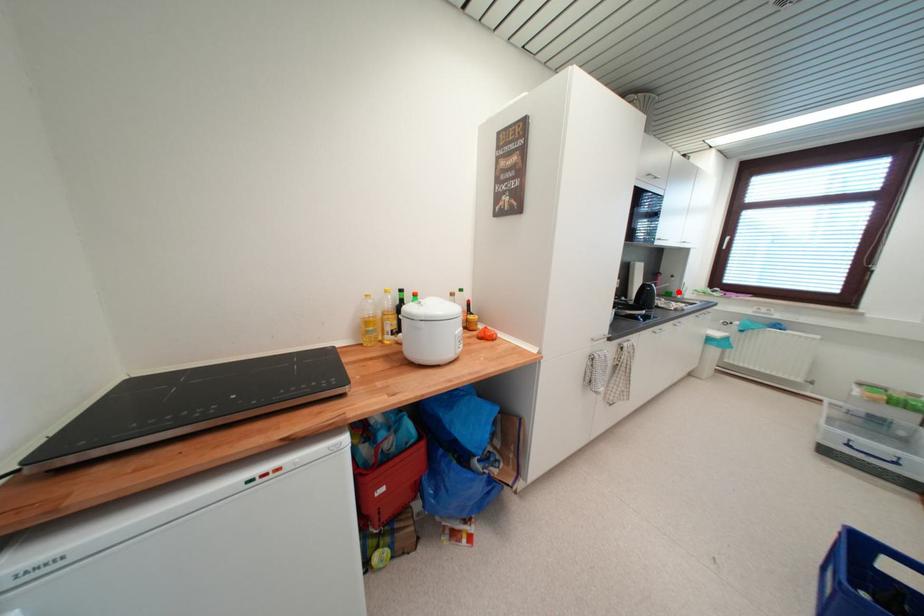
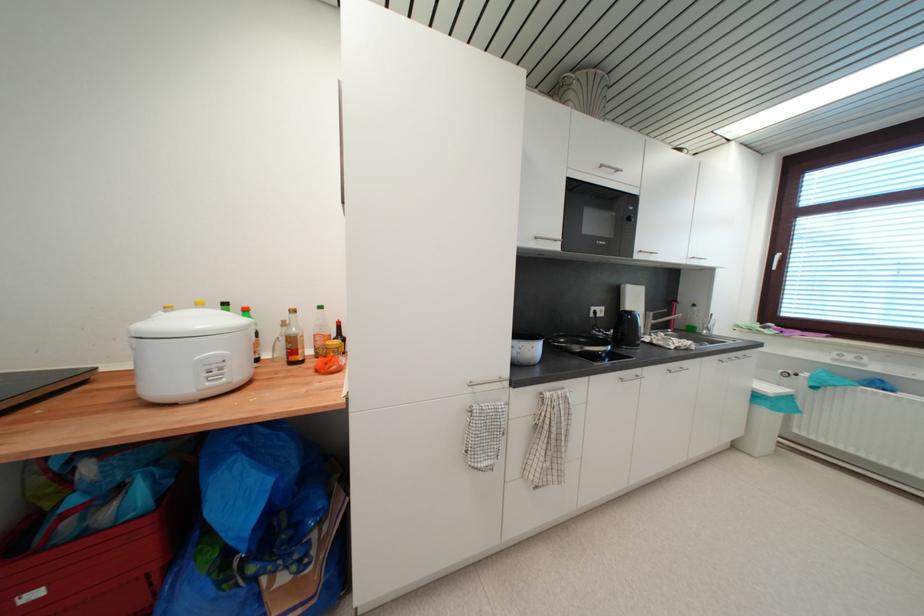
The point at the highlighted location is marked in the first image. Where is the corresponding point in the second image?

(701, 326)